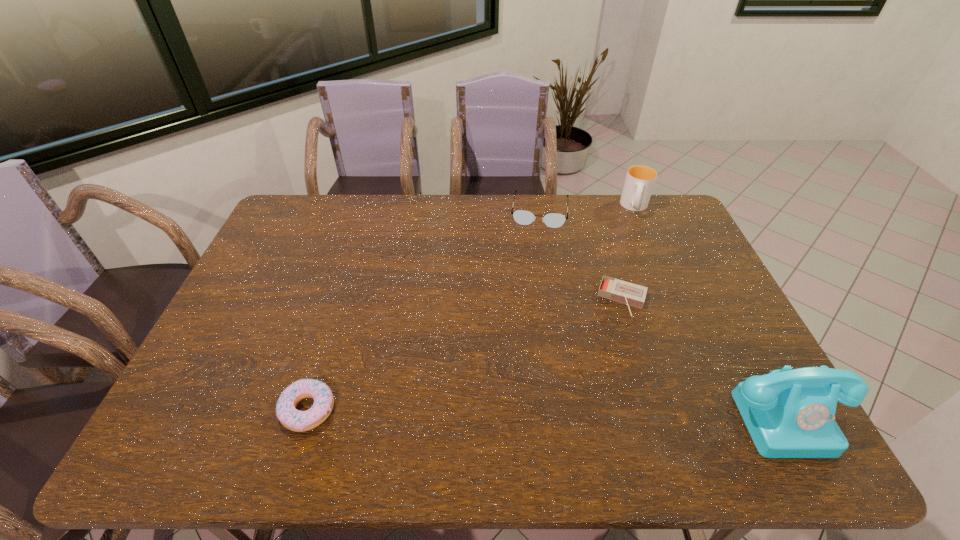
Where is `doughnut`? The height and width of the screenshot is (540, 960). doughnut is located at coordinates (299, 421).

The image size is (960, 540). Identify the location of the fourth tallest object. (299, 421).

What are the coordinates of `telephone` in the screenshot? It's located at (789, 413).

You are a GUI agent. You are given a task and a screenshot of the screen. Output one action in this format:
    pyautogui.click(x=<x>, y=<y>)
    Task: Click on the third object from right to left
    
    Given the screenshot: What is the action you would take?
    pyautogui.click(x=628, y=293)

Image resolution: width=960 pixels, height=540 pixels. Identify the location of matchbox. (628, 293).

You are a GUI agent. You are given a task and a screenshot of the screen. Output one action in this format:
    pyautogui.click(x=<x>, y=<y>)
    Task: Click on the third shortest object
    The height and width of the screenshot is (540, 960).
    Given the screenshot: What is the action you would take?
    pyautogui.click(x=523, y=217)

Image resolution: width=960 pixels, height=540 pixels. I want to click on spectacles, so click(523, 217).

You are a GUI agent. You are given a task and a screenshot of the screen. Output one action in this format:
    pyautogui.click(x=<x>, y=<y>)
    Task: Click on the cup
    
    Given the screenshot: What is the action you would take?
    pyautogui.click(x=640, y=180)

Where is `vacant area located on the right of the second shortest object`? Image resolution: width=960 pixels, height=540 pixels. vacant area located on the right of the second shortest object is located at coordinates (410, 410).

You are a GUI agent. You are given a task and a screenshot of the screen. Output one action in this format:
    pyautogui.click(x=<x>, y=<y>)
    Task: Click on the vacant area located on the striking surface of the third farthest object
    The height and width of the screenshot is (540, 960).
    Given the screenshot: What is the action you would take?
    pyautogui.click(x=613, y=330)